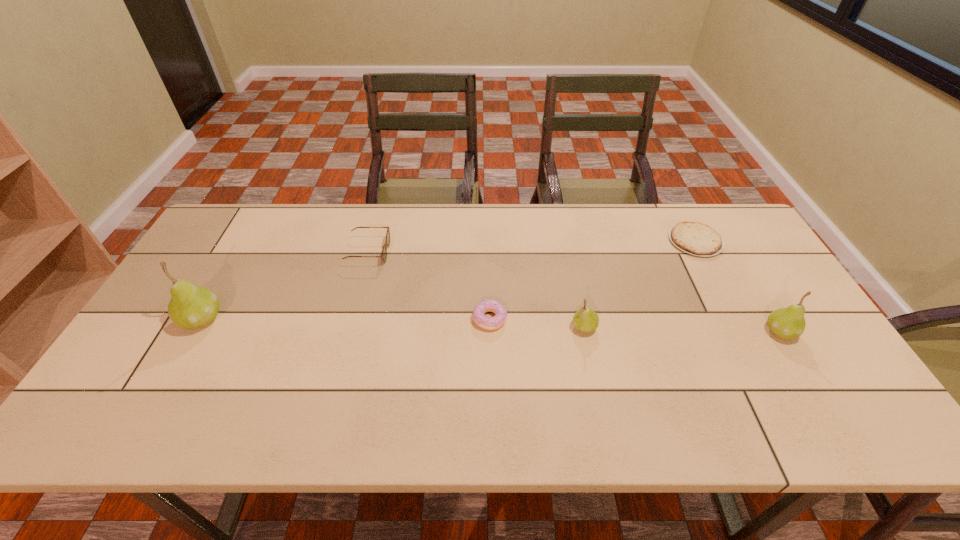
Image resolution: width=960 pixels, height=540 pixels. I want to click on vacant area that lies between the spectacles and the leftmost pear, so click(x=285, y=286).

The height and width of the screenshot is (540, 960). Identify the location of vacant area that lies between the tortilla and the third shortest object. (532, 247).

Where is `free space that is in between the fourth tallest object and the shortest object`? This screenshot has width=960, height=540. free space that is in between the fourth tallest object and the shortest object is located at coordinates (532, 247).

Identify the location of unoccupied area between the second tallest pear and the shortest object. (737, 286).

Locate an element on the screen. This screenshot has width=960, height=540. unoccupied position between the fourth tallest object and the tallest object is located at coordinates (285, 286).

At what (x,y) coordinates should I click in order to perform the action: click on empty space between the fourth object from left to right and the tallest object. Please return your answer as a coordinate pair (x, y). The width and height of the screenshot is (960, 540). Looking at the image, I should click on (393, 323).

This screenshot has height=540, width=960. Identify the location of free space between the second shortest pear and the fifth tallest object. (636, 325).

The height and width of the screenshot is (540, 960). What are the coordinates of `vacant area that lies between the second shortest object and the spectacles` in the screenshot? It's located at (429, 285).

You are a GUI agent. You are given a task and a screenshot of the screen. Output one action in this format:
    pyautogui.click(x=<x>, y=<y>)
    Task: Click on the empty space that is in between the fourth shortest object and the fifth object from right to left
    The image size is (960, 540).
    Given the screenshot: What is the action you would take?
    pyautogui.click(x=476, y=289)

I want to click on object that is the second closest one to the fourth object from left to right, so click(695, 238).